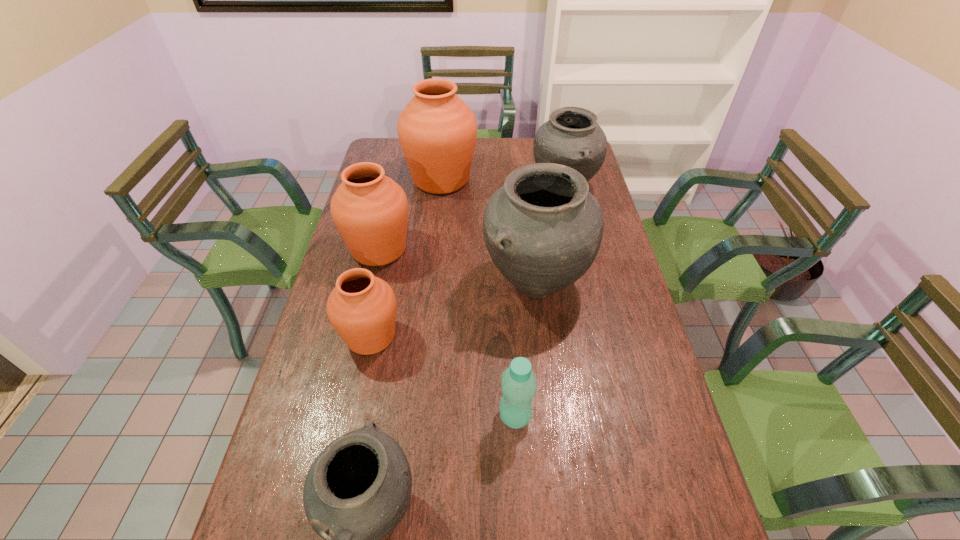
Select which object appears as the third closest to the farthest brown urn. Please provide its 2D coordinates. Your answer should be formatted as a tuple, i.e. [(x, y)], where the tuple contains the x and y coordinates of a point satisfying the conditions above.

[(543, 229)]

Select which urn appears as the second closest to the nearest brown urn. Please provide its 2D coordinates. Your answer should be formatted as a tuple, i.e. [(x, y)], where the tuple contains the x and y coordinates of a point satisfying the conditions above.

[(543, 229)]

Locate an element on the screen. urn that is the third closest to the farthest black urn is located at coordinates (370, 210).

Locate an element on the screen. The width and height of the screenshot is (960, 540). brown urn that stands as the second closest to the farthest black urn is located at coordinates (370, 210).

Locate an element on the screen. brown urn that stands as the closest to the second smallest black urn is located at coordinates (437, 131).

This screenshot has width=960, height=540. What are the coordinates of `black urn that is the closest to the nearest object` in the screenshot? It's located at coord(543,229).

Identify which black urn is the third closest to the sixth farthest object. Please provide its 2D coordinates. Your answer should be formatted as a tuple, i.e. [(x, y)], where the tuple contains the x and y coordinates of a point satisfying the conditions above.

[(572, 137)]

You are a GUI agent. You are given a task and a screenshot of the screen. Output one action in this format:
    pyautogui.click(x=<x>, y=<y>)
    Task: Click on the vacant region that satisfies the following two spatial constraints: 1. on the back side of the second biggest black urn; 2. on the right side of the second farthest black urn
    This screenshot has width=960, height=540.
    Given the screenshot: What is the action you would take?
    pyautogui.click(x=524, y=188)

This screenshot has width=960, height=540. I want to click on free spot that satisfies the following two spatial constraints: 1. on the front side of the second nearest black urn; 2. on the left side of the second nearest brown urn, so click(x=372, y=283).